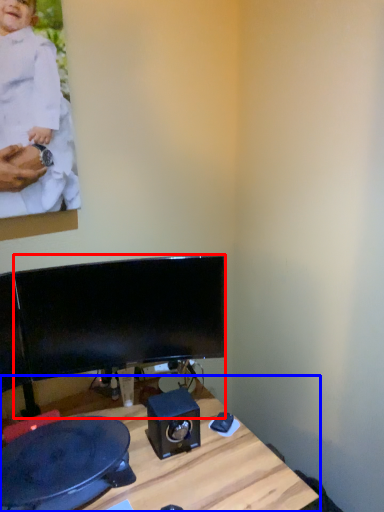
Question: Which object is further to the camera taking this photo, computer monitor (highlighted by a red box) or desk (highlighted by a blue box)?

Choices:
 (A) computer monitor
 (B) desk

Answer: (A)